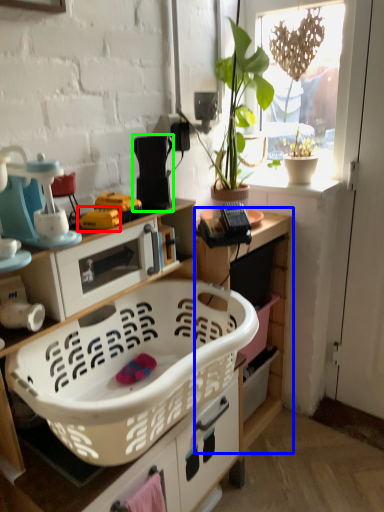
Question: Estimate the real-world distances between objects in this image. Which object is farther from toy (highlighted by a red box), cabinetry (highlighted by a blue box) or appliance (highlighted by a green box)?

Choices:
 (A) cabinetry
 (B) appliance

Answer: (A)